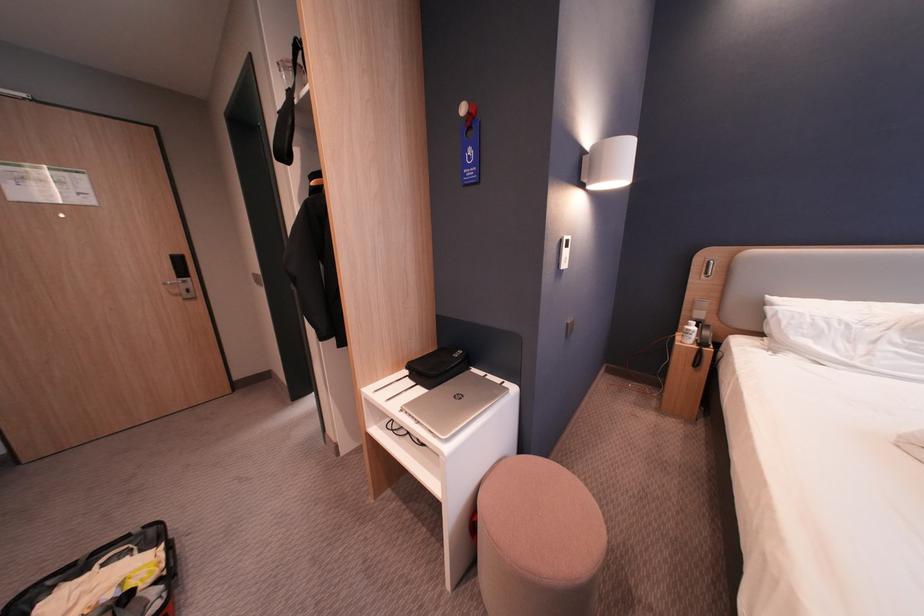
Where would you turn the silver door handle? Please return your answer as a coordinate pair (x, y).

(179, 283)